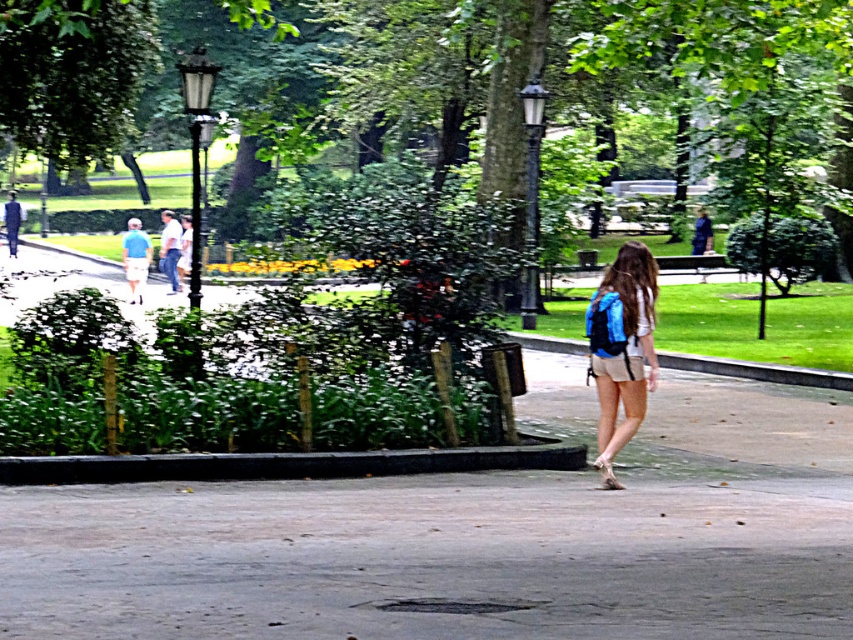
Between gray concrete pavement at center and blue fabric backpack at center, which one is positioned lower?

Positioned lower is gray concrete pavement at center.

Where is `gray concrete pavement at center`? gray concrete pavement at center is located at coordinates (428, 557).